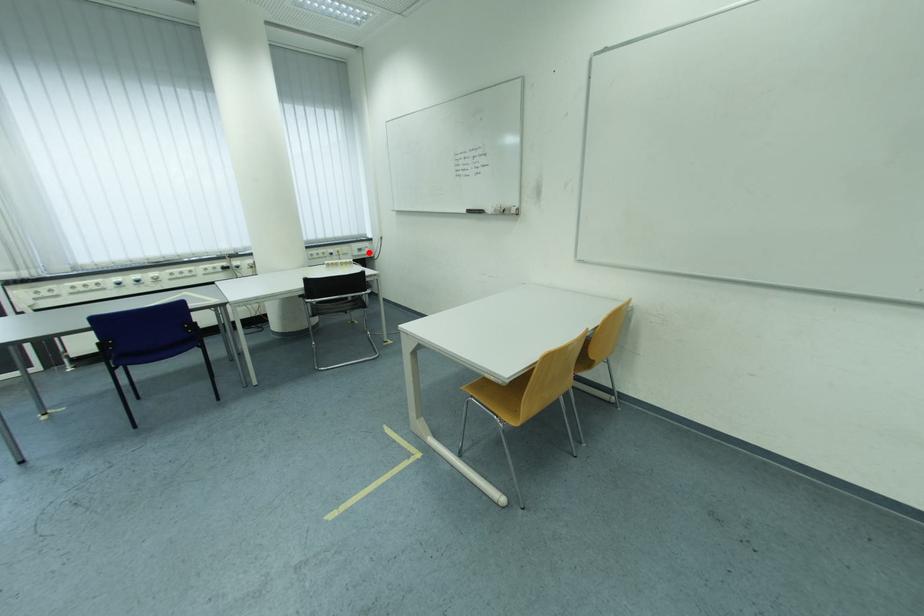
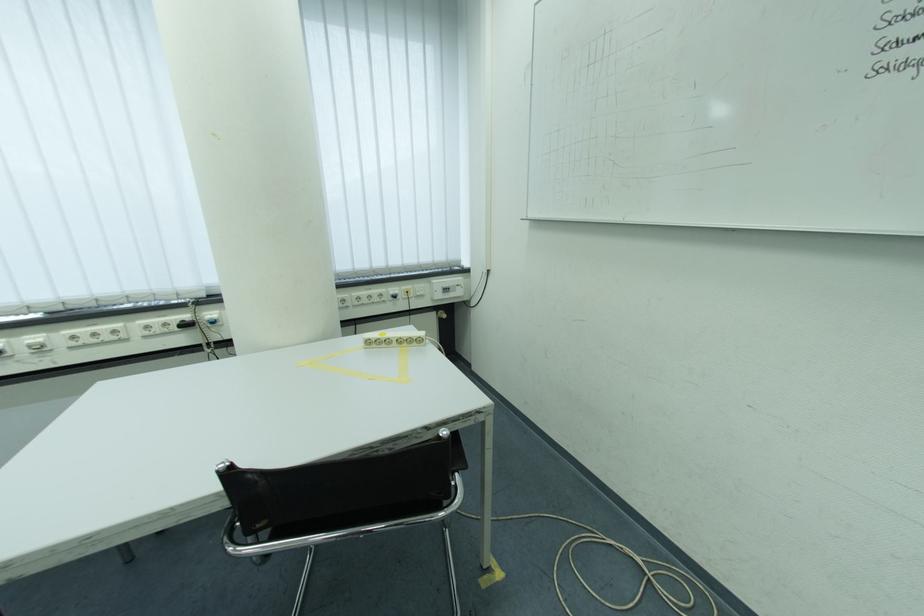
Question: I am providing you with two images of the same scene from different viewpoints. A red point is shown in image1. For the corresponding object point in image2, is it positioned nearer or farther from the camera?

Choices:
 (A) Nearer
 (B) Farther

Answer: (B)